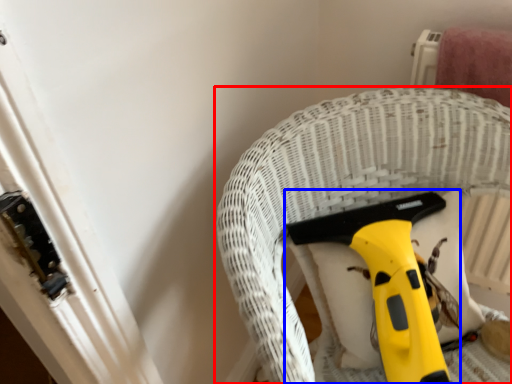
Question: Which object appears farthest to the camera in this image, furniture (highlighted by a red box) or tool (highlighted by a blue box)?

Choices:
 (A) furniture
 (B) tool

Answer: (B)